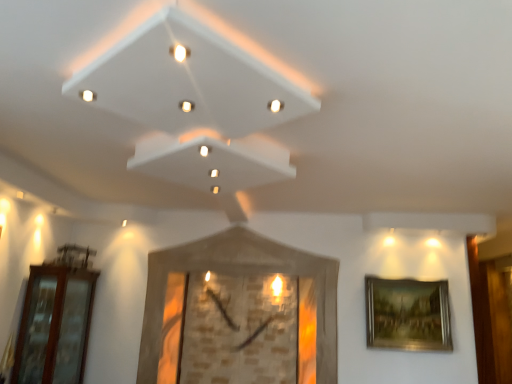
Question: Does wooden clock at center, the first picture frame in the left-to-right sequence, have a greater width compared to gold metallic picture frame at right, the first picture frame viewed from the right?

Choices:
 (A) no
 (B) yes

Answer: (B)

Question: Is wooden clock at center, the first picture frame in the left-to-right sequence, outside of gold metallic picture frame at right, placed as the 2th picture frame when sorted from left to right?

Choices:
 (A) no
 (B) yes

Answer: (B)

Question: Considering the relative sizes of wooden clock at center, the 2th picture frame positioned from the right, and gold metallic picture frame at right, placed as the 2th picture frame when sorted from left to right, in the image provided, is wooden clock at center, the 2th picture frame positioned from the right, thinner than gold metallic picture frame at right, placed as the 2th picture frame when sorted from left to right,?

Choices:
 (A) no
 (B) yes

Answer: (A)

Question: Considering the relative sizes of wooden clock at center, the 2th picture frame positioned from the right, and gold metallic picture frame at right, placed as the 2th picture frame when sorted from left to right, in the image provided, is wooden clock at center, the 2th picture frame positioned from the right, bigger than gold metallic picture frame at right, placed as the 2th picture frame when sorted from left to right,?

Choices:
 (A) yes
 (B) no

Answer: (A)

Question: From the image's perspective, is wooden clock at center, the first picture frame in the left-to-right sequence, located above gold metallic picture frame at right, placed as the 2th picture frame when sorted from left to right?

Choices:
 (A) yes
 (B) no

Answer: (A)

Question: From the image's perspective, is brown glass door at left positioned above or below wooden clock at center, the 2th picture frame positioned from the right?

Choices:
 (A) below
 (B) above

Answer: (A)

Question: Based on their positions, is brown glass door at left located to the left or right of wooden clock at center, the 2th picture frame positioned from the right?

Choices:
 (A) left
 (B) right

Answer: (A)

Question: From a real-world perspective, is brown glass door at left above or below wooden clock at center, the first picture frame in the left-to-right sequence?

Choices:
 (A) below
 (B) above

Answer: (A)

Question: In terms of size, does brown glass door at left appear bigger or smaller than wooden clock at center, the first picture frame in the left-to-right sequence?

Choices:
 (A) small
 (B) big

Answer: (A)

Question: Is wooden clock at center, the first picture frame in the left-to-right sequence, taller or shorter than gold metallic picture frame at right, placed as the 2th picture frame when sorted from left to right?

Choices:
 (A) tall
 (B) short

Answer: (A)

Question: From a real-world perspective, is wooden clock at center, the 2th picture frame positioned from the right, physically located above or below gold metallic picture frame at right, placed as the 2th picture frame when sorted from left to right?

Choices:
 (A) above
 (B) below

Answer: (A)

Question: In the image, is wooden clock at center, the 2th picture frame positioned from the right, on the left side or the right side of gold metallic picture frame at right, placed as the 2th picture frame when sorted from left to right?

Choices:
 (A) left
 (B) right

Answer: (A)

Question: Considering the positions of wooden clock at center, the 2th picture frame positioned from the right, and gold metallic picture frame at right, the first picture frame viewed from the right, in the image, is wooden clock at center, the 2th picture frame positioned from the right, wider or thinner than gold metallic picture frame at right, the first picture frame viewed from the right,?

Choices:
 (A) wide
 (B) thin

Answer: (A)

Question: From the image's perspective, is gold metallic picture frame at right, placed as the 2th picture frame when sorted from left to right, positioned above or below wooden clock at center, the 2th picture frame positioned from the right?

Choices:
 (A) below
 (B) above

Answer: (A)

Question: From a real-world perspective, is gold metallic picture frame at right, placed as the 2th picture frame when sorted from left to right, positioned above or below wooden clock at center, the 2th picture frame positioned from the right?

Choices:
 (A) above
 (B) below

Answer: (B)